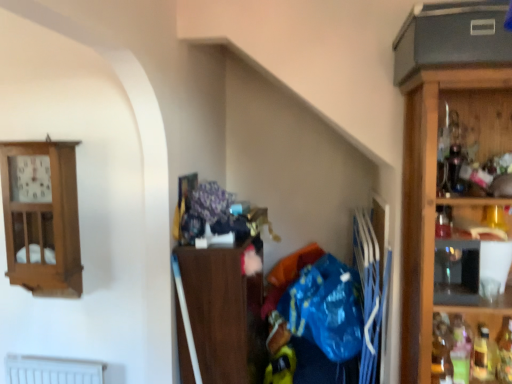
Locate an element on the screen. The width and height of the screenshot is (512, 384). wooden clock at upper left, acting as the 2th cabinetry starting from the right is located at coordinates (42, 217).

This screenshot has height=384, width=512. I want to click on translucent glass bottle at lower right, marked as the third bottle in a right-to-left arrangement, so click(x=461, y=350).

Measure the distance between translucent glass bottle at lower right, placed as the second bottle when sorted from left to right, and camera.

translucent glass bottle at lower right, placed as the second bottle when sorted from left to right, and camera are 1.50 meters apart.

Measure the distance between point (478, 325) and camera.

Point (478, 325) and camera are 5.52 feet apart from each other.

Where is `brown wood cabinet at center, arranged as the 2th cabinetry when viewed from the left`? This screenshot has width=512, height=384. brown wood cabinet at center, arranged as the 2th cabinetry when viewed from the left is located at coordinates (219, 308).

At what (x,y) coordinates should I click in order to perform the action: click on blue plastic bag at center. Please return your answer as a coordinate pair (x, y). The width and height of the screenshot is (512, 384). Looking at the image, I should click on (318, 317).

Does translucent glass bottle at right, the first bottle viewed from the left, have a lesser height compared to blue plastic bag at center?

Yes, translucent glass bottle at right, the first bottle viewed from the left, is shorter than blue plastic bag at center.

Based on the photo, is translucent glass bottle at right, the fourth bottle when ordered from right to left, to the left or to the right of blue plastic bag at center in the image?

In the image, translucent glass bottle at right, the fourth bottle when ordered from right to left, appears on the right side of blue plastic bag at center.

From a real-world perspective, which is physically below, translucent glass bottle at right, the first bottle viewed from the left, or blue plastic bag at center?

In real-world perspective, blue plastic bag at center is lower.

Which object is thinner, translucent glass bottle at right, the first bottle viewed from the left, or blue plastic bag at center?

Thinner between the two is translucent glass bottle at right, the first bottle viewed from the left.

From the translucent glass bottle at right, the fourth bottle when ordered from right to left, count 1st bottles backward and point to it. Please provide its 2D coordinates.

[(461, 350)]

Is point (468, 379) more distant than point (448, 347)?

No.

From a real-world perspective, is translucent glass bottle at lower right, placed as the second bottle when sorted from left to right, beneath translucent glass bottle at right, the fourth bottle when ordered from right to left?

Indeed, from a real-world perspective, translucent glass bottle at lower right, placed as the second bottle when sorted from left to right, is positioned beneath translucent glass bottle at right, the fourth bottle when ordered from right to left.

Considering the sizes of objects blue plastic bag at center and brown wood cabinet at center, arranged as the 2th cabinetry when viewed from the left, in the image provided, who is shorter, blue plastic bag at center or brown wood cabinet at center, arranged as the 2th cabinetry when viewed from the left,?

blue plastic bag at center.

Where is `cabinetry below the blue plastic bag at center (from the image's perspective)`? cabinetry below the blue plastic bag at center (from the image's perspective) is located at coordinates (219, 308).

Is blue plastic bag at center at the right side of brown wood cabinet at center, arranged as the 2th cabinetry when viewed from the left?

Indeed, blue plastic bag at center is positioned on the right side of brown wood cabinet at center, arranged as the 2th cabinetry when viewed from the left.

Is blue plastic bag at center positioned with its back to brown wood cabinet at center, the 1th cabinetry from the right?

blue plastic bag at center does not have its back to brown wood cabinet at center, the 1th cabinetry from the right.

Between blue plastic bag at center and translucent glass bottle at lower right, which appears as the 2th bottle when viewed from the right, which one appears on the left side from the viewer's perspective?

blue plastic bag at center.

Looking at this image, from the image's perspective, would you say blue plastic bag at center is positioned over translucent glass bottle at lower right, arranged as the third bottle when viewed from the left?

Yes.

Does blue plastic bag at center turn towards translucent glass bottle at lower right, arranged as the third bottle when viewed from the left?

No, blue plastic bag at center is not turned towards translucent glass bottle at lower right, arranged as the third bottle when viewed from the left.

Is translucent glass bottle at lower right, which appears as the 2th bottle when viewed from the right, inside blue plastic bag at center?

No, translucent glass bottle at lower right, which appears as the 2th bottle when viewed from the right, is located outside of blue plastic bag at center.

The width and height of the screenshot is (512, 384). In order to click on bottle on the right of translucent glass bottle at lower right, arranged as the third bottle when viewed from the left in this screenshot , I will do `click(505, 352)`.

Between translucent glass bottle at lower right, which appears as the 2th bottle when viewed from the right, and translucent plastic bottle at lower right, the 1th bottle positioned from the right, which one appears on the right side from the viewer's perspective?

translucent plastic bottle at lower right, the 1th bottle positioned from the right.

Does translucent glass bottle at lower right, which appears as the 2th bottle when viewed from the right, have a greater height compared to translucent plastic bottle at lower right, which is the 4th bottle from left to right?

No, translucent glass bottle at lower right, which appears as the 2th bottle when viewed from the right, is not taller than translucent plastic bottle at lower right, which is the 4th bottle from left to right.

Between point (494, 365) and point (500, 364), which one is positioned in front?

The point (500, 364) is more forward.

Based on their sizes in the image, would you say translucent glass bottle at right, the first bottle viewed from the left, is bigger or smaller than translucent glass bottle at lower right, arranged as the third bottle when viewed from the left?

In the image, translucent glass bottle at right, the first bottle viewed from the left, appears to be larger than translucent glass bottle at lower right, arranged as the third bottle when viewed from the left.

Which object is positioned more to the right, translucent glass bottle at right, the first bottle viewed from the left, or translucent glass bottle at lower right, arranged as the third bottle when viewed from the left?

Positioned to the right is translucent glass bottle at lower right, arranged as the third bottle when viewed from the left.

Choose the correct answer: Is translucent glass bottle at right, the fourth bottle when ordered from right to left, inside translucent glass bottle at lower right, which appears as the 2th bottle when viewed from the right, or outside it?

translucent glass bottle at right, the fourth bottle when ordered from right to left, cannot be found inside translucent glass bottle at lower right, which appears as the 2th bottle when viewed from the right.

Are translucent glass bottle at right, the fourth bottle when ordered from right to left, and translucent glass bottle at lower right, arranged as the third bottle when viewed from the left, making contact?

No, translucent glass bottle at right, the fourth bottle when ordered from right to left, is not with translucent glass bottle at lower right, arranged as the third bottle when viewed from the left.

Is translucent glass bottle at lower right, marked as the third bottle in a right-to-left arrangement, facing towards wooden clock at upper left, the 1th cabinetry from the left?

No, translucent glass bottle at lower right, marked as the third bottle in a right-to-left arrangement, does not turn towards wooden clock at upper left, the 1th cabinetry from the left.

Is translucent glass bottle at lower right, placed as the second bottle when sorted from left to right, spatially inside wooden clock at upper left, the 1th cabinetry from the left, or outside of it?

translucent glass bottle at lower right, placed as the second bottle when sorted from left to right, is not inside wooden clock at upper left, the 1th cabinetry from the left, it's outside.

Based on the photo, which of these two, translucent glass bottle at lower right, placed as the second bottle when sorted from left to right, or wooden clock at upper left, the 1th cabinetry from the left, stands taller?

Standing taller between the two is wooden clock at upper left, the 1th cabinetry from the left.

From a real-world perspective, starting from the blue plastic bag at center, which bottle is the 1st one vertically above it? Please provide its 2D coordinates.

[(441, 350)]

From the image's perspective, starting from the translucent glass bottle at lower right, marked as the third bottle in a right-to-left arrangement, which bottle is the 1st one above? Please provide its 2D coordinates.

[(441, 350)]

Which object lies nearer to the anchor point translucent glass bottle at lower right, which appears as the 2th bottle when viewed from the right, wooden clock at upper left, the 1th cabinetry from the left, or translucent plastic bottle at lower right, the 1th bottle positioned from the right?

Among the two, translucent plastic bottle at lower right, the 1th bottle positioned from the right, is located nearer to translucent glass bottle at lower right, which appears as the 2th bottle when viewed from the right.

Looking at the image, which one is located further to translucent glass bottle at right, the fourth bottle when ordered from right to left, wooden clock at upper left, acting as the 2th cabinetry starting from the right, or translucent glass bottle at lower right, placed as the second bottle when sorted from left to right?

wooden clock at upper left, acting as the 2th cabinetry starting from the right, is further to translucent glass bottle at right, the fourth bottle when ordered from right to left.

Considering their positions, is translucent glass bottle at right, the first bottle viewed from the left, positioned closer to translucent glass bottle at lower right, which appears as the 2th bottle when viewed from the right, than translucent plastic bottle at lower right, the 1th bottle positioned from the right?

translucent plastic bottle at lower right, the 1th bottle positioned from the right, is closer to translucent glass bottle at lower right, which appears as the 2th bottle when viewed from the right.

Considering their positions, is translucent plastic bottle at lower right, the 1th bottle positioned from the right, positioned further to translucent glass bottle at lower right, marked as the third bottle in a right-to-left arrangement, than wooden clock at upper left, acting as the 2th cabinetry starting from the right?

wooden clock at upper left, acting as the 2th cabinetry starting from the right.

Which object lies further to the anchor point wooden clock at upper left, the 1th cabinetry from the left, translucent glass bottle at right, the first bottle viewed from the left, or translucent plastic bottle at lower right, which is the 4th bottle from left to right?

translucent plastic bottle at lower right, which is the 4th bottle from left to right, lies further to wooden clock at upper left, the 1th cabinetry from the left, than the other object.

Which object lies nearer to the anchor point translucent glass bottle at lower right, placed as the second bottle when sorted from left to right, wooden clock at upper left, acting as the 2th cabinetry starting from the right, or blue plastic bag at center?

blue plastic bag at center is positioned closer to the anchor translucent glass bottle at lower right, placed as the second bottle when sorted from left to right.

Considering their positions, is translucent plastic bottle at lower right, the 1th bottle positioned from the right, positioned closer to wooden clock at upper left, the 1th cabinetry from the left, than translucent glass bottle at lower right, marked as the third bottle in a right-to-left arrangement?

Among the two, translucent glass bottle at lower right, marked as the third bottle in a right-to-left arrangement, is located nearer to wooden clock at upper left, the 1th cabinetry from the left.

When comparing their distances from translucent glass bottle at lower right, marked as the third bottle in a right-to-left arrangement, does translucent glass bottle at right, the fourth bottle when ordered from right to left, or translucent plastic bottle at lower right, which is the 4th bottle from left to right, seem further?

translucent plastic bottle at lower right, which is the 4th bottle from left to right, is further to translucent glass bottle at lower right, marked as the third bottle in a right-to-left arrangement.

Locate an element on the screen. This screenshot has width=512, height=384. waste between brown wood cabinet at center, arranged as the 2th cabinetry when viewed from the left, and translucent glass bottle at lower right, placed as the second bottle when sorted from left to right, in the horizontal direction is located at coordinates (318, 317).

Find the location of a particular element. waste located between brown wood cabinet at center, the 1th cabinetry from the right, and translucent glass bottle at right, the fourth bottle when ordered from right to left, in the left-right direction is located at coordinates (318, 317).

The height and width of the screenshot is (384, 512). Identify the location of waste between wooden clock at upper left, acting as the 2th cabinetry starting from the right, and translucent plastic bottle at lower right, which is the 4th bottle from left to right, from left to right. (318, 317).

This screenshot has width=512, height=384. Find the location of `bottle located between translucent glass bottle at right, the first bottle viewed from the left, and translucent glass bottle at lower right, which appears as the 2th bottle when viewed from the right, in the left-right direction`. bottle located between translucent glass bottle at right, the first bottle viewed from the left, and translucent glass bottle at lower right, which appears as the 2th bottle when viewed from the right, in the left-right direction is located at coordinates (461, 350).